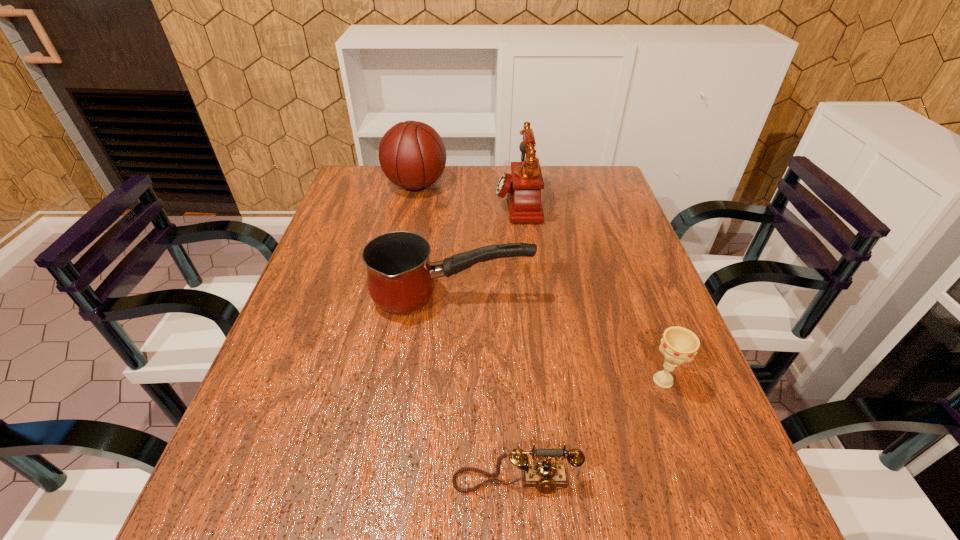
You are a GUI agent. You are given a task and a screenshot of the screen. Output one action in this format:
    pyautogui.click(x=<x>, y=<y>)
    Task: Click on the farther telephone
    The image size is (960, 540).
    Given the screenshot: What is the action you would take?
    pyautogui.click(x=523, y=188)

Where is `basketball`? This screenshot has height=540, width=960. basketball is located at coordinates click(412, 155).

At what (x,y) coordinates should I click in order to perform the action: click on the third nearest object. Please return your answer as a coordinate pair (x, y). Looking at the image, I should click on (400, 276).

The image size is (960, 540). In order to click on saucepan in this screenshot , I will do `click(400, 276)`.

The height and width of the screenshot is (540, 960). I want to click on the second shortest object, so click(x=679, y=345).

The height and width of the screenshot is (540, 960). What are the coordinates of `chalice` in the screenshot? It's located at (679, 345).

Find the location of a particular element. the shorter telephone is located at coordinates (545, 476).

You are a GUI agent. You are given a task and a screenshot of the screen. Output one action in this format:
    pyautogui.click(x=<x>, y=<y>)
    Task: Click on the nearest object
    
    Given the screenshot: What is the action you would take?
    pyautogui.click(x=545, y=476)

I want to click on free space located on the dial of the taller telephone, so click(x=383, y=202).

Find the location of a particular element. The height and width of the screenshot is (540, 960). vacant region located on the dial of the taller telephone is located at coordinates (476, 202).